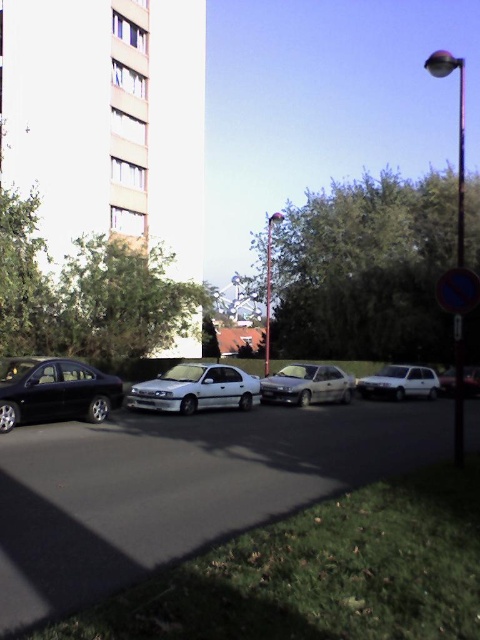
You are a delivery person trying to park your van which is 1.8 meters tall. You see the white matte hatchback at center and the white matte car at lower right in the parking lot. Which parking spot would be suitable for your van based on their heights?

The white matte hatchback at center has a lesser height compared to the white matte car at lower right, so the parking spot for the white matte hatchback at center would be suitable for your van since it is shorter than 1.8 meters.

You are a delivery person trying to locate the black metallic car at center in the parking area. According to the coordinates provided, where would you find it?

The black metallic car at center is located at coordinates point [180,488].

You are standing at the point marked by the coordinates point (x=180, y=488) in the parking area. Which car are you closest to?

The point (x=180, y=488) corresponds to the black metallic car at center, so you are closest to the black metallic car at center.